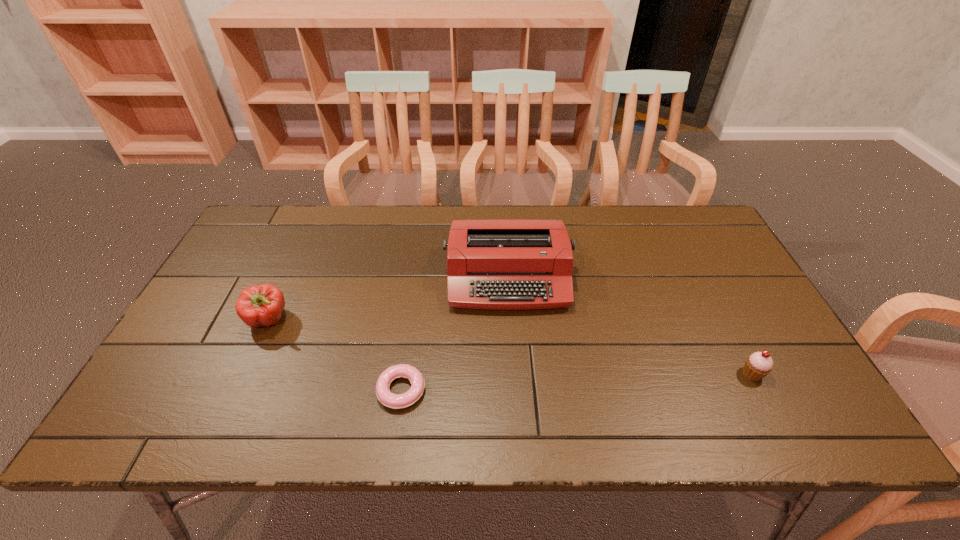
Locate an element on the screen. The height and width of the screenshot is (540, 960). object situated at the far edge is located at coordinates (491, 264).

Identify the location of object present at the near edge. This screenshot has width=960, height=540. 395,401.

Find the location of a particular element. The image size is (960, 540). object present at the left edge is located at coordinates [259, 305].

The image size is (960, 540). Find the location of `object located in the right edge section of the desktop`. object located in the right edge section of the desktop is located at coordinates (758, 365).

At what (x,y) coordinates should I click in order to perform the action: click on vacant region at the far edge of the desktop. Please return your answer as a coordinate pair (x, y). Image resolution: width=960 pixels, height=540 pixels. Looking at the image, I should click on (349, 250).

Locate an element on the screen. The width and height of the screenshot is (960, 540). vacant space at the near edge of the desktop is located at coordinates (339, 428).

Where is `vacant area at the left edge`? vacant area at the left edge is located at coordinates (238, 261).

Find the location of a particular element. The image size is (960, 540). free space at the right edge is located at coordinates (728, 263).

The height and width of the screenshot is (540, 960). In order to click on vacant region at the far right corner of the desktop in this screenshot , I will do `click(675, 208)`.

Where is `free spot between the second shortest object and the shortest object`? The image size is (960, 540). free spot between the second shortest object and the shortest object is located at coordinates (577, 382).